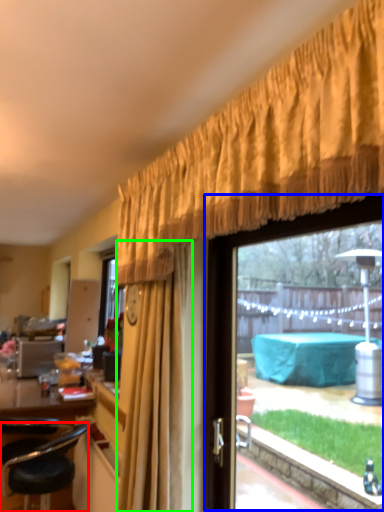
Question: Which object is the closest to the chair (highlighted by a red box)? Choose among these: window (highlighted by a blue box) or curtain (highlighted by a green box).

Choices:
 (A) window
 (B) curtain

Answer: (B)